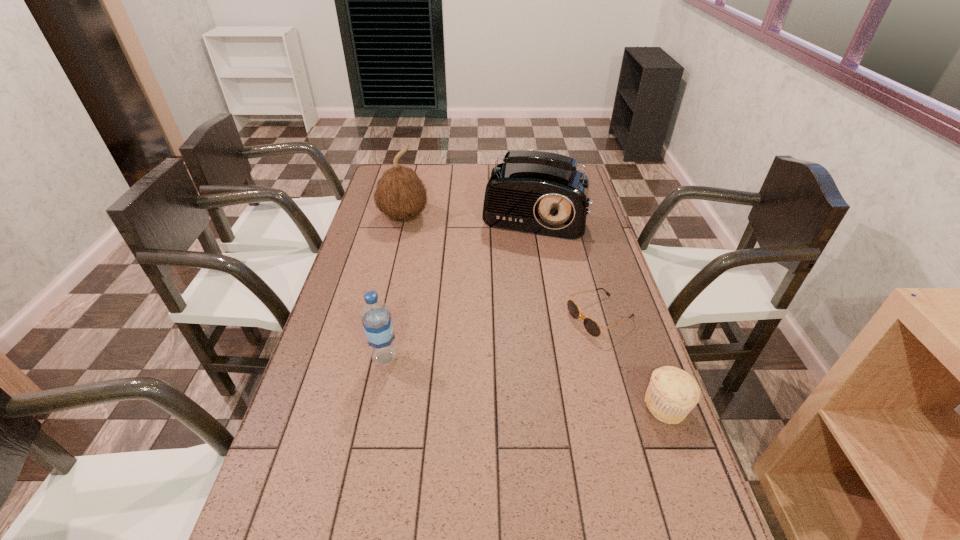
Identify the location of the second nearest object. The image size is (960, 540). (376, 318).

Locate an element on the screen. Image resolution: width=960 pixels, height=540 pixels. the third shortest object is located at coordinates (376, 318).

You are a GUI agent. You are given a task and a screenshot of the screen. Output one action in this format:
    pyautogui.click(x=<x>, y=<y>)
    Task: Click on the fourth tallest object
    The width and height of the screenshot is (960, 540).
    Given the screenshot: What is the action you would take?
    pyautogui.click(x=672, y=393)

Image resolution: width=960 pixels, height=540 pixels. Find the location of `muffin`. muffin is located at coordinates (672, 393).

This screenshot has width=960, height=540. Identify the location of radio receiver. (536, 192).

Locate an element on the screen. sunglasses is located at coordinates (591, 326).

The height and width of the screenshot is (540, 960). What are the coordinates of `the third farthest object` in the screenshot? It's located at (591, 326).

You are a GUI agent. You are given a task and a screenshot of the screen. Output one action in this format:
    pyautogui.click(x=<x>, y=<y>)
    Task: Click on the coconut
    
    Given the screenshot: What is the action you would take?
    pyautogui.click(x=400, y=194)

Find the location of a particular element. The height and width of the screenshot is (540, 960). vacant area situated on the label of the fourth farthest object is located at coordinates (465, 358).

The width and height of the screenshot is (960, 540). I want to click on free space located 0.200m on the left of the second shortest object, so click(562, 406).